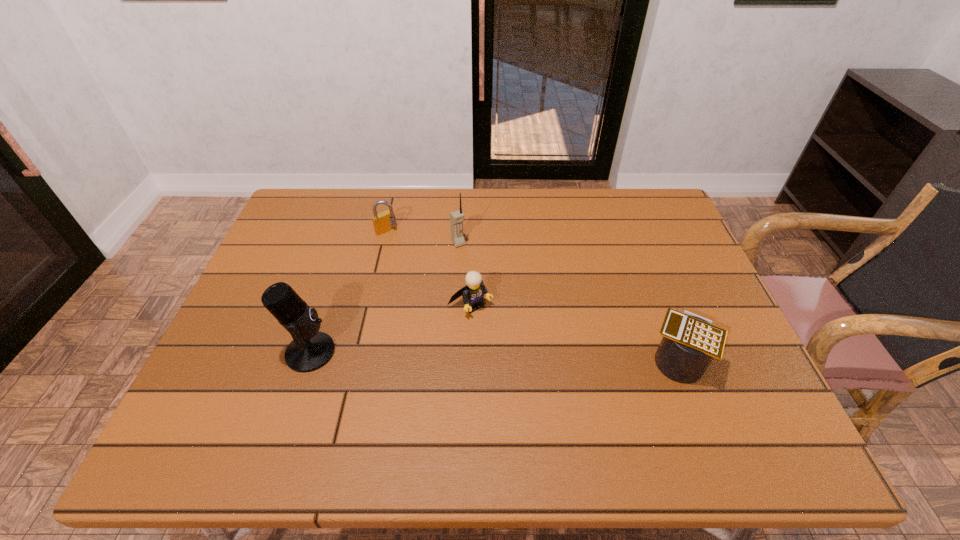
Locate an element on the screen. Image resolution: width=960 pixels, height=540 pixels. microphone is located at coordinates (310, 349).

Image resolution: width=960 pixels, height=540 pixels. Identify the location of the tallest object. (310, 349).

The height and width of the screenshot is (540, 960). Find the location of `calculator`. calculator is located at coordinates (690, 342).

You are a GUI agent. You are given a task and a screenshot of the screen. Output one action in this format:
    pyautogui.click(x=<x>, y=<y>)
    Task: Click on the second object from left to right
    
    Given the screenshot: What is the action you would take?
    pyautogui.click(x=383, y=222)

Where is `the farthest object`? This screenshot has height=540, width=960. the farthest object is located at coordinates (383, 222).

The image size is (960, 540). Identify the location of the second tallest object. (456, 218).

Find the location of a particular element. cellular telephone is located at coordinates (456, 218).

Locate an element on the screen. Lego is located at coordinates (473, 293).

You are a GUI agent. You are given a task and a screenshot of the screen. Output one action in this format:
    pyautogui.click(x=<x>, y=<y>)
    Task: Click on the free location located on the stand of the tallest object
    The image size is (960, 540).
    Given the screenshot: What is the action you would take?
    pyautogui.click(x=394, y=352)

The width and height of the screenshot is (960, 540). What are the coordinates of `vacant region located 0.330m on the back of the rightmost object` in the screenshot? It's located at (634, 245).